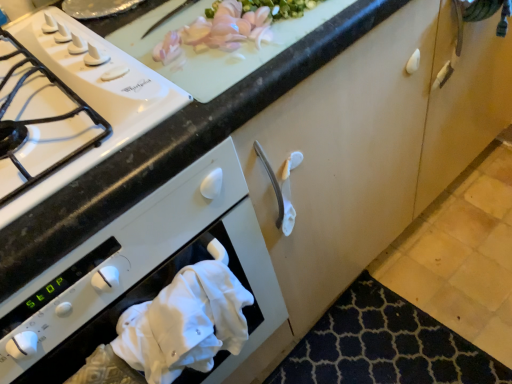
Find the location of a particular element. vacant space underneath dark blue textured mat at lower right (from a real-world perspective) is located at coordinates (389, 350).